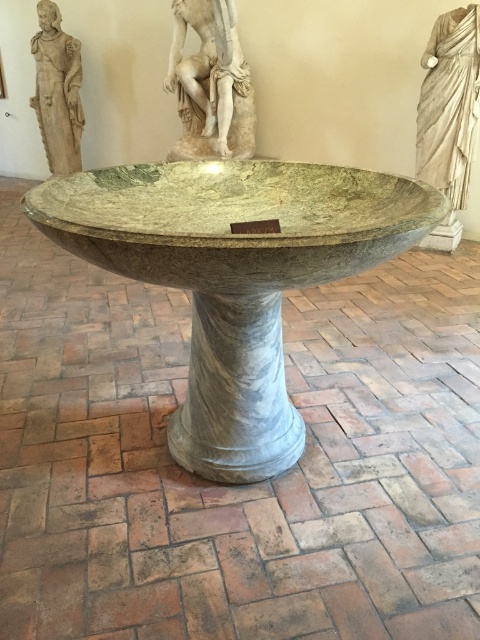
Who is higher up, green marble bowl at center or marble statue at upper left?

Positioned higher is marble statue at upper left.

Between green marble bowl at center and marble statue at upper left, which one is positioned lower?

green marble bowl at center is lower down.

Which is behind, point (276, 186) or point (80, 122)?

The point (80, 122) is behind.

Image resolution: width=480 pixels, height=640 pixels. Find the location of `green marble bowl at center`. green marble bowl at center is located at coordinates (235, 276).

Between green marble bowl at center and white marble statue at upper center, which one appears on the left side from the viewer's perspective?

Positioned to the left is white marble statue at upper center.

Between green marble bowl at center and white marble statue at upper center, which one is positioned higher?

Positioned higher is white marble statue at upper center.

Identify the location of green marble bowl at center. (235, 276).

I want to click on green marble bowl at center, so click(235, 276).

Does green marble bowl at center appear over white marble draped cloth at upper right?

Actually, green marble bowl at center is below white marble draped cloth at upper right.

Does green marble bowl at center have a lesser width compared to white marble draped cloth at upper right?

No, green marble bowl at center is not thinner than white marble draped cloth at upper right.

Which is in front, point (304, 236) or point (416, 164)?

Point (304, 236) is more forward.

You are a GUI agent. You are given a task and a screenshot of the screen. Output one action in this format:
    pyautogui.click(x=<x>, y=<y>)
    Task: Click on the green marble bowl at center
    
    Given the screenshot: What is the action you would take?
    pyautogui.click(x=235, y=276)